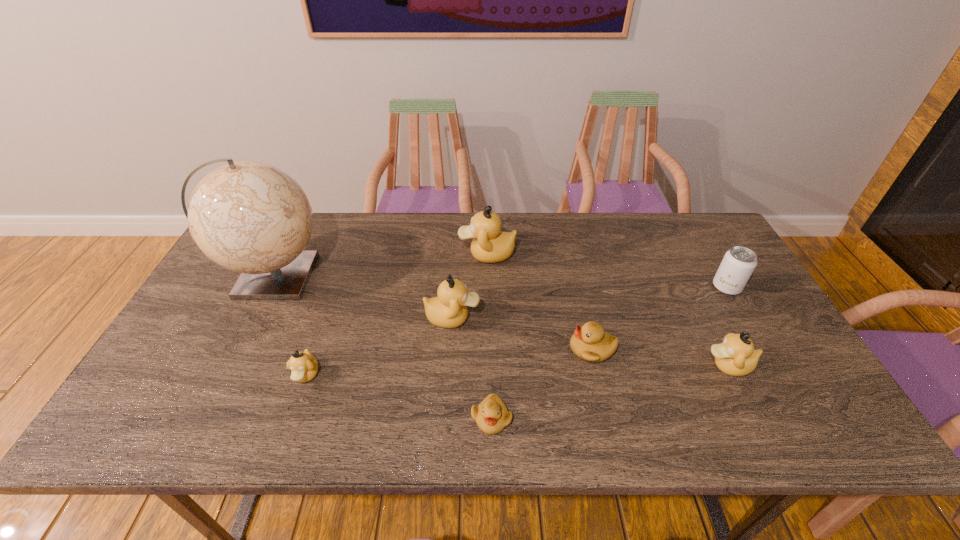
Identify the location of object present at the near edge. This screenshot has height=540, width=960. (491, 415).

Find the location of `object positioned at the left edge`. object positioned at the left edge is located at coordinates (252, 218).

The width and height of the screenshot is (960, 540). Find the location of `soda can present at the right edge`. soda can present at the right edge is located at coordinates (738, 264).

At what (x,y) coordinates should I click in order to perform the action: click on duckling that is at the right edge. Please return your answer as a coordinate pair (x, y). Looking at the image, I should click on (736, 356).

This screenshot has width=960, height=540. Identify the location of object present at the far left corner. (252, 218).

Locate an element on the screen. This screenshot has height=540, width=960. free space at the far edge of the desktop is located at coordinates (444, 224).

In the image, there is a desktop. At what (x,y) coordinates should I click in order to perform the action: click on vacant space at the near edge. Please return your answer as a coordinate pair (x, y). Looking at the image, I should click on (353, 431).

Where is `free location at the left edge`? free location at the left edge is located at coordinates (210, 393).

Where is `vacant area at the right edge`? vacant area at the right edge is located at coordinates (780, 360).

Where is `vacant region between the leftmost object and the tallest duckling`? This screenshot has height=540, width=960. vacant region between the leftmost object and the tallest duckling is located at coordinates (380, 265).